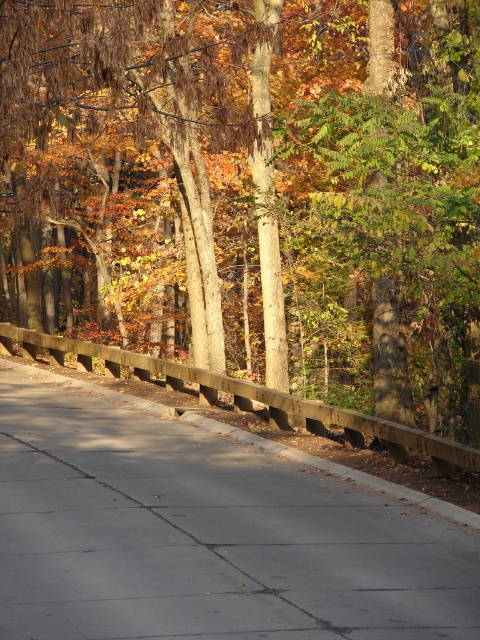
In the scene shown: You are a gardener who needs to place a new flower pot on the concrete at center. The flower pot must be placed below the brown wooden fence at center. Is this possible?

Yes, the flower pot can be placed below the brown wooden fence at center because the brown wooden fence at center is located above the concrete at center.

You are standing on the concrete at center and want to walk towards the brown wooden fence at center. Which direction should you face?

You should face to the left because the brown wooden fence at center is to the left of concrete at center.

You are standing at the point labeled as point (255, 188) in the image. What object is directly in front of you?

The point (255, 188) corresponds to the brown wooden fence at center, so the object directly in front of you is the brown wooden fence at center.